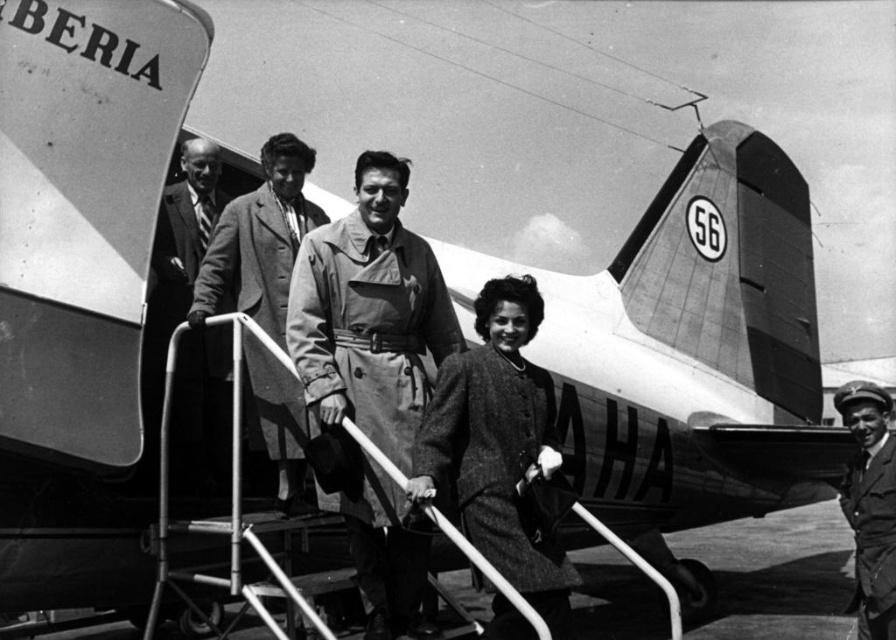
Question: Observing the image, what is the correct spatial positioning of light brown leather coat at center in reference to metallic silver ladder at center?

Choices:
 (A) left
 (B) right

Answer: (A)

Question: Among these objects, which one is nearest to the camera?

Choices:
 (A) light brown leather coat at center
 (B) metallic silver ladder at center

Answer: (B)

Question: Does matte brown coat at center appear under light brown leather coat at center?

Choices:
 (A) yes
 (B) no

Answer: (A)

Question: Which point appears farthest from the camera in this image?

Choices:
 (A) (214, 147)
 (B) (274, 560)
 (C) (395, 234)

Answer: (A)

Question: Which point is farther to the camera?

Choices:
 (A) (287, 285)
 (B) (162, 321)
 (C) (392, 534)
 (D) (162, 579)

Answer: (A)

Question: From the image, what is the correct spatial relationship of matte brown coat at center in relation to light brown leather coat at center?

Choices:
 (A) above
 (B) below

Answer: (B)